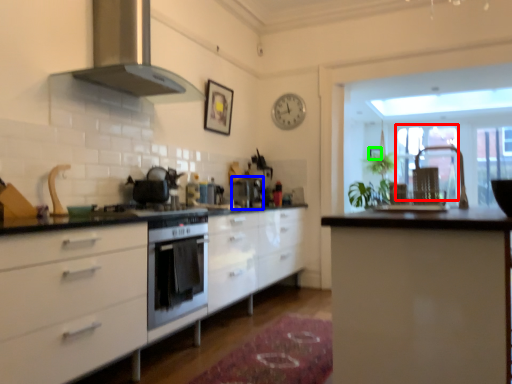
Question: Which object is positioned farthest from glass door (highlighted by a red box)? Select from coffee machine (highlighted by a blue box) and picture frame (highlighted by a green box).

Choices:
 (A) coffee machine
 (B) picture frame

Answer: (A)